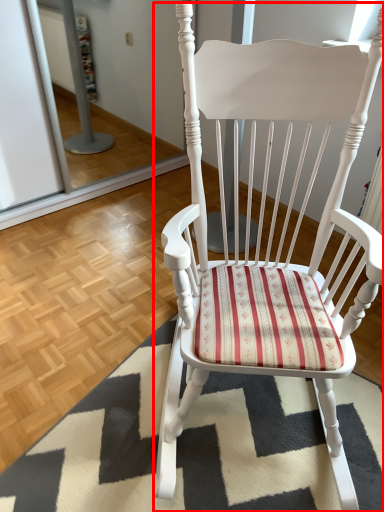
Question: From the image's perspective, where is chair (annotated by the red box) located in relation to doormat in the image?

Choices:
 (A) above
 (B) below

Answer: (A)